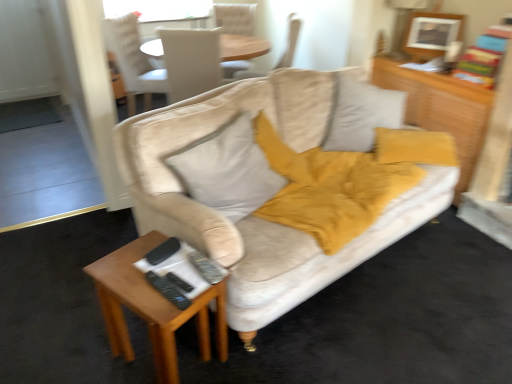
The height and width of the screenshot is (384, 512). In order to click on free spot to the right of wooden rectangular table at lower left in this screenshot , I will do `click(261, 354)`.